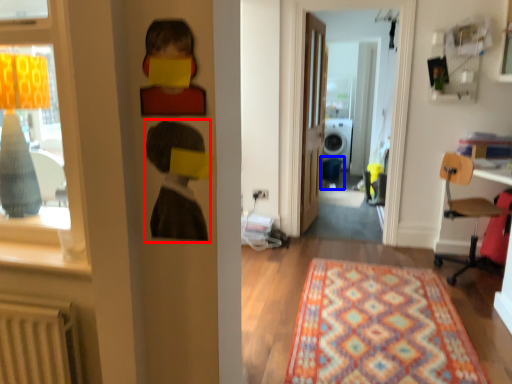
Question: Which point is further to the camera, person (highlighted by a red box) or armchair (highlighted by a blue box)?

Choices:
 (A) person
 (B) armchair

Answer: (B)